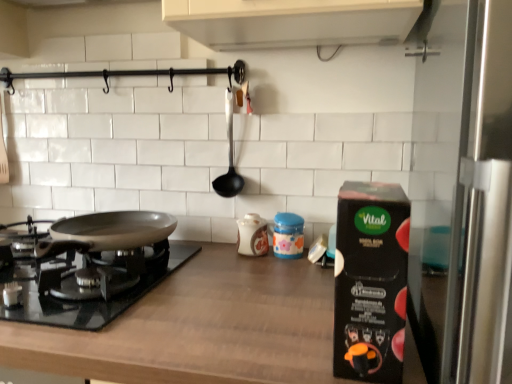
I want to click on vacant space to the left of black cardboard box at right, which appears as the 1th kitchen appliance when viewed from the front, so click(x=264, y=341).